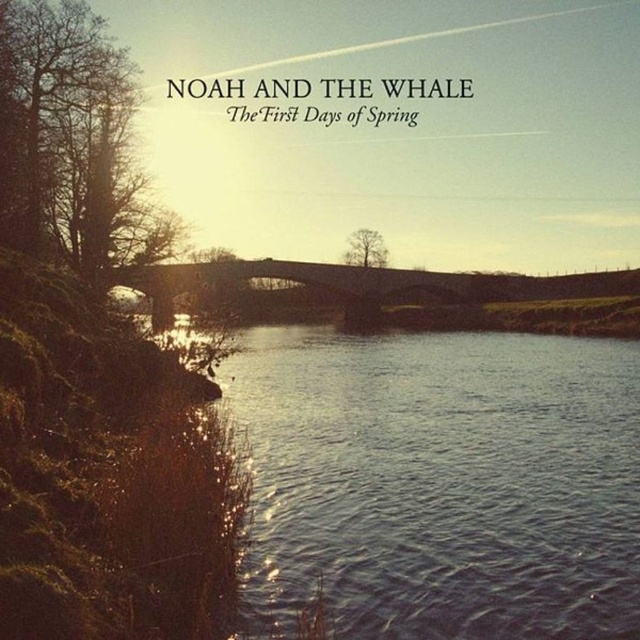
Does bare wood tree at left have a larger size compared to bare wood tree at center?

Yes, bare wood tree at left is bigger than bare wood tree at center.

Is point (144, 209) positioned behind point (372, 234)?

That is False.

What do you see at coordinates (72, 144) in the screenshot? I see `bare wood tree at left` at bounding box center [72, 144].

At what (x,y) coordinates should I click in order to perform the action: click on bare wood tree at left. Please return your answer as a coordinate pair (x, y). The image size is (640, 640). Looking at the image, I should click on (72, 144).

Between blue water at center and bare wood tree at left, which one has more height?

Standing taller between the two is bare wood tree at left.

Describe the element at coordinates (440, 483) in the screenshot. The width and height of the screenshot is (640, 640). I see `blue water at center` at that location.

The height and width of the screenshot is (640, 640). I want to click on blue water at center, so tap(440, 483).

Is blue water at center further to camera compared to bare wood tree at center?

No.

Who is lower down, blue water at center or bare wood tree at center?

Positioned lower is blue water at center.

This screenshot has height=640, width=640. I want to click on blue water at center, so click(x=440, y=483).

Identify the location of blue water at center. (440, 483).